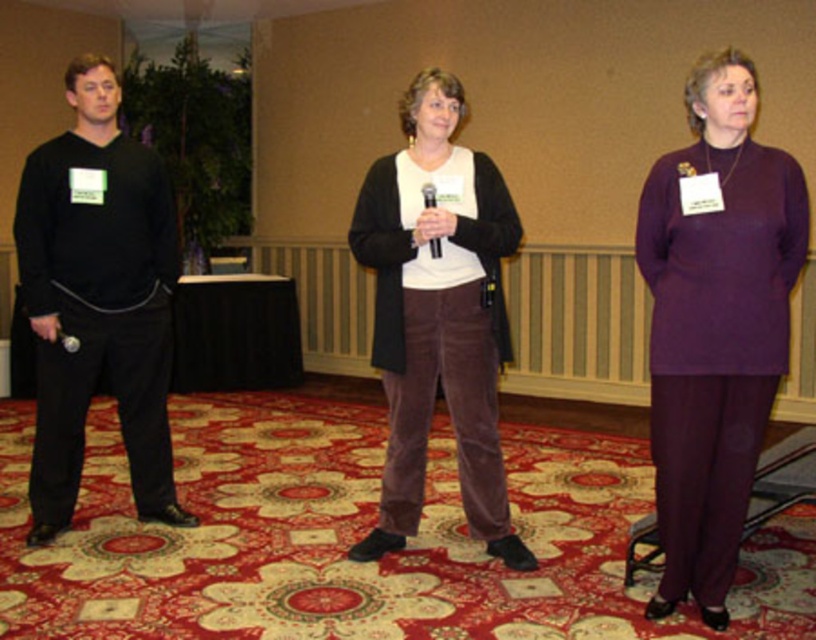
Which is more to the left, purple matte pants at center or black matte pants at left?

From the viewer's perspective, black matte pants at left appears more on the left side.

Is purple matte pants at center shorter than black matte pants at left?

Yes, purple matte pants at center is shorter than black matte pants at left.

Does point (738, 385) lie in front of point (122, 314)?

Yes.

Identify the location of purple matte pants at center. This screenshot has height=640, width=816. tap(715, 323).

Can you confirm if black matte pants at left is smaller than matte black microphone at lower left?

No, black matte pants at left is not smaller than matte black microphone at lower left.

Which is behind, point (109, 253) or point (64, 348)?

The point (64, 348) is more distant.

Identify the location of black matte pants at left. (96, 298).

Measure the distance between purple matte pants at center and matte black microphone at lower left.

purple matte pants at center is 8.20 feet from matte black microphone at lower left.

What do you see at coordinates (715, 323) in the screenshot?
I see `purple matte pants at center` at bounding box center [715, 323].

You are a GUI agent. You are given a task and a screenshot of the screen. Output one action in this format:
    pyautogui.click(x=<x>, y=<y>)
    Task: Click on the purple matte pants at center
    The height and width of the screenshot is (640, 816).
    Given the screenshot: What is the action you would take?
    pyautogui.click(x=715, y=323)